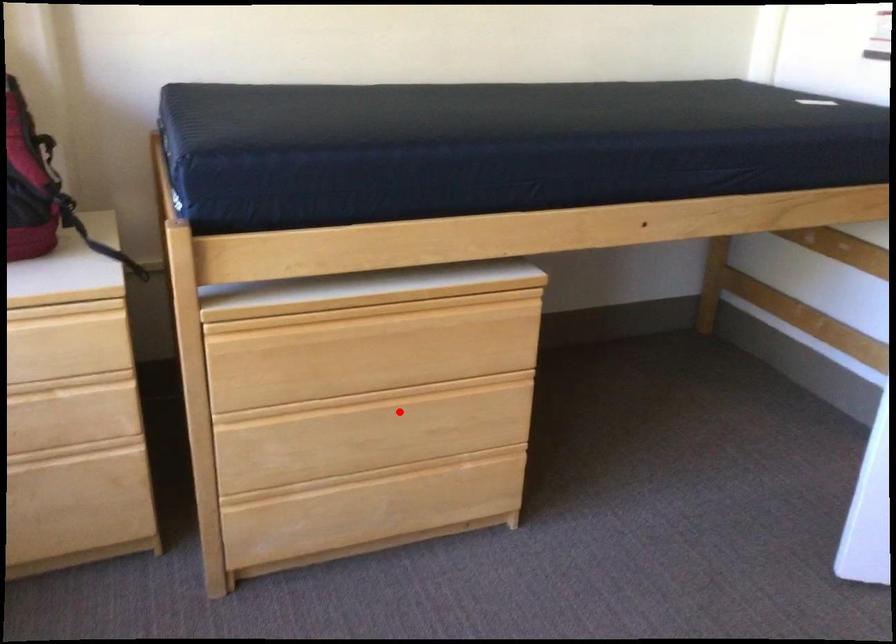
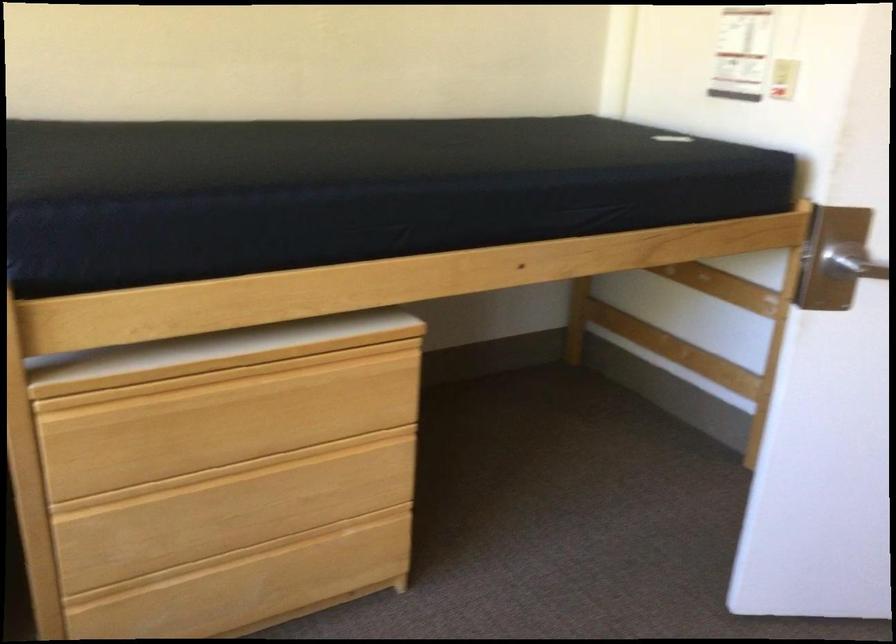
Question: I am providing you with two images of the same scene from different viewpoints. A red point is shown in image1. For the corresponding object point in image2, is it positioned nearer or farther from the camera?

Choices:
 (A) Nearer
 (B) Farther

Answer: (A)